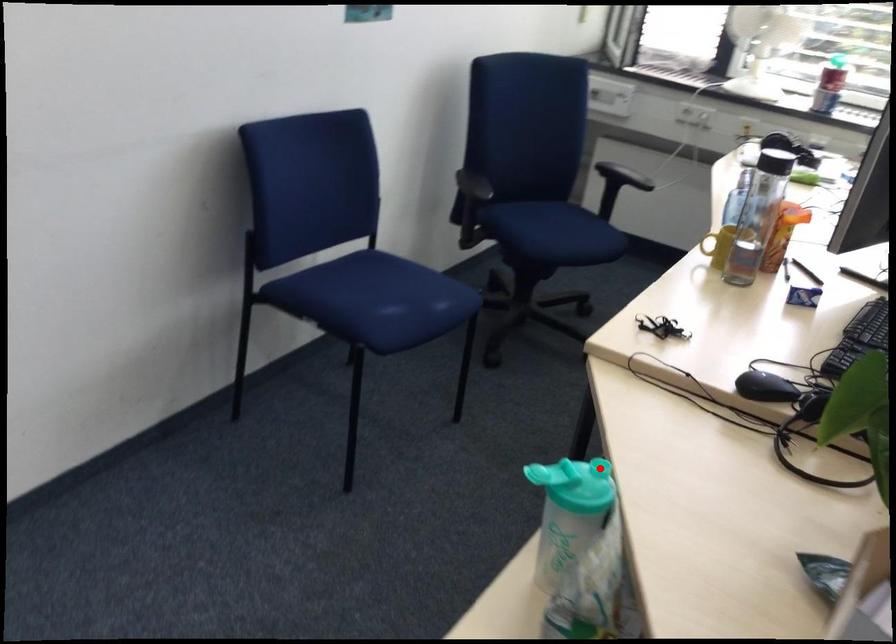
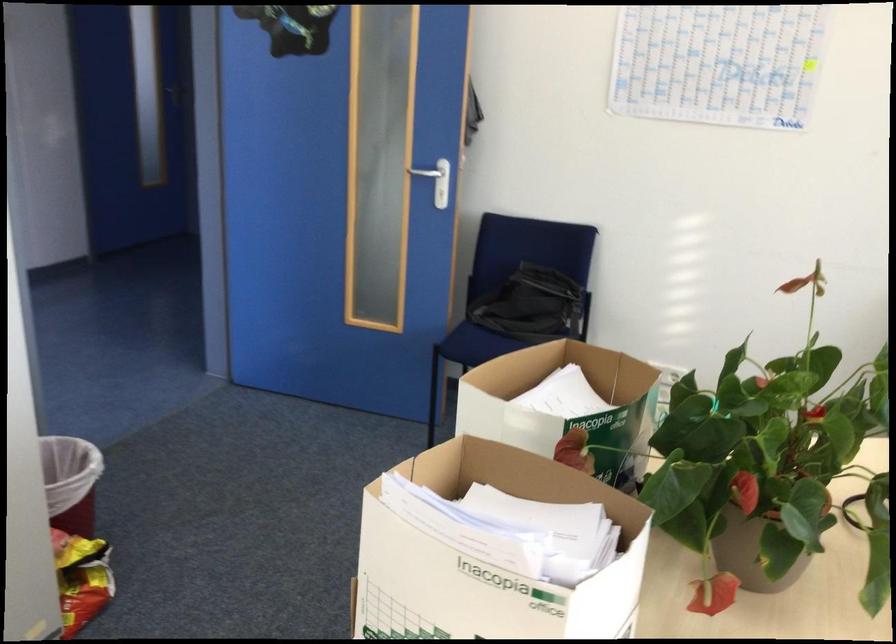
Question: I am providing you with two images of the same scene from different viewpoints. A red point is marked on the first image. Can you still see the location of the red point in image 2?

Choices:
 (A) Yes
 (B) No

Answer: (B)